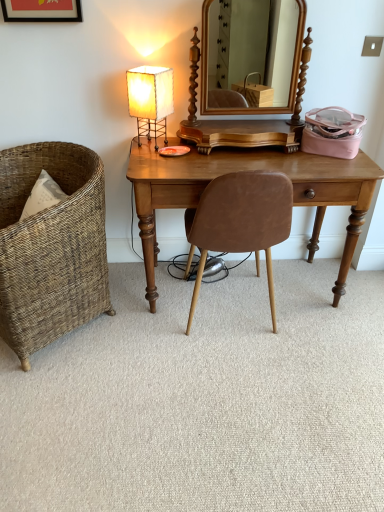
This screenshot has height=512, width=384. Find the location of `free space on the front side of woven wicker chair at left, arranged as the first chair when viewed from the left`. free space on the front side of woven wicker chair at left, arranged as the first chair when viewed from the left is located at coordinates (74, 402).